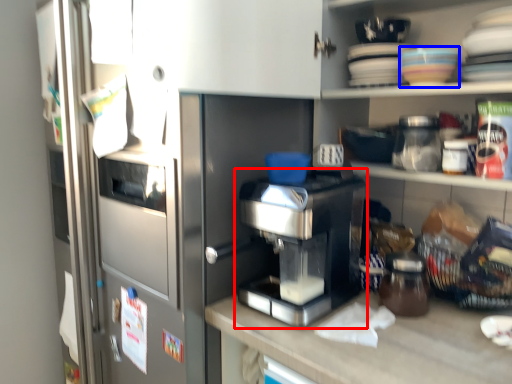
Question: Which object is closer to the camera taking this photo, home appliance (highlighted by a red box) or tableware (highlighted by a blue box)?

Choices:
 (A) home appliance
 (B) tableware

Answer: (A)